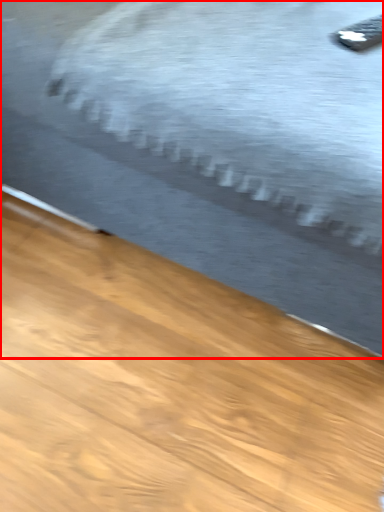
Question: From the image's perspective, what is the correct spatial relationship of bed (annotated by the red box) in relation to remote?

Choices:
 (A) above
 (B) below

Answer: (A)